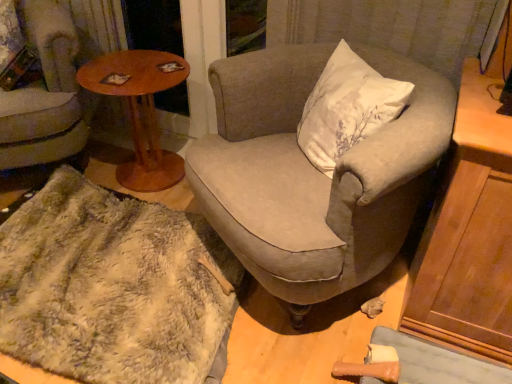
Question: Is textured gray armchair at center, the first chair positioned from the right, in front of or behind fuzzy white blanket at lower left in the image?

Choices:
 (A) front
 (B) behind

Answer: (A)

Question: Considering the positions of textured gray armchair at center, the first chair positioned from the right, and fuzzy white blanket at lower left in the image, is textured gray armchair at center, the first chair positioned from the right, wider or thinner than fuzzy white blanket at lower left?

Choices:
 (A) thin
 (B) wide

Answer: (A)

Question: Which of these objects is positioned closest to the textured gray armchair at center, marked as the second chair in a left-to-right arrangement?

Choices:
 (A) wooden round table at left
 (B) fuzzy white blanket at lower left
 (C) wooden round table at left
 (D) fuzzy fabric chair at lower left, positioned as the first chair in left-to-right order

Answer: (B)

Question: Based on their relative distances, which object is farther from the fuzzy fabric chair at lower left, positioned as the first chair in left-to-right order?

Choices:
 (A) textured gray armchair at center, marked as the second chair in a left-to-right arrangement
 (B) fuzzy white blanket at lower left
 (C) wooden round table at left
 (D) wooden round table at left

Answer: (A)